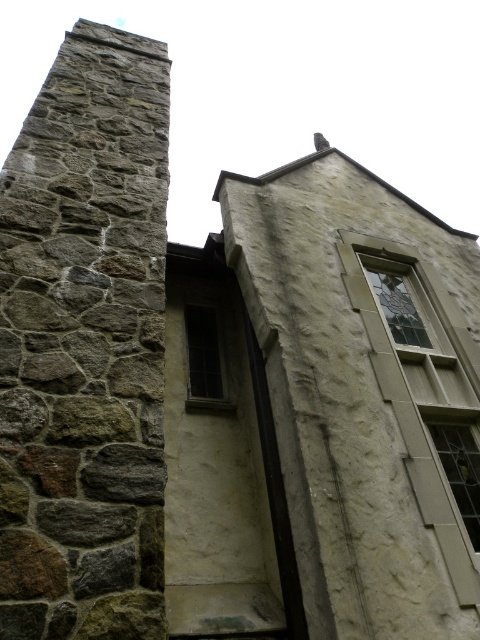
Is clear glass window at center shorter than clear glass window at center right?

In fact, clear glass window at center may be taller than clear glass window at center right.

From the picture: Can you confirm if clear glass window at center is taller than clear glass window at center right?

Indeed, clear glass window at center has a greater height compared to clear glass window at center right.

Where is `clear glass window at center`? clear glass window at center is located at coordinates (423, 385).

Which is above, clear glass window at center or dark glass window at center?

Positioned higher is dark glass window at center.

Which is more to the right, clear glass window at center or dark glass window at center?

From the viewer's perspective, clear glass window at center appears more on the right side.

Between point (395, 346) and point (203, 333), which one is positioned in front?

Point (395, 346) is more forward.

Identify the location of clear glass window at center. (423, 385).

Is point (50, 531) more distant than point (210, 336)?

No, it is in front of (210, 336).

Is point (104, 584) closer to viewer compared to point (204, 314)?

Yes, it is.

Which is in front, point (9, 410) or point (226, 387)?

Point (9, 410) is in front.

The image size is (480, 640). I want to click on rustic stone chimney at left, so click(84, 346).